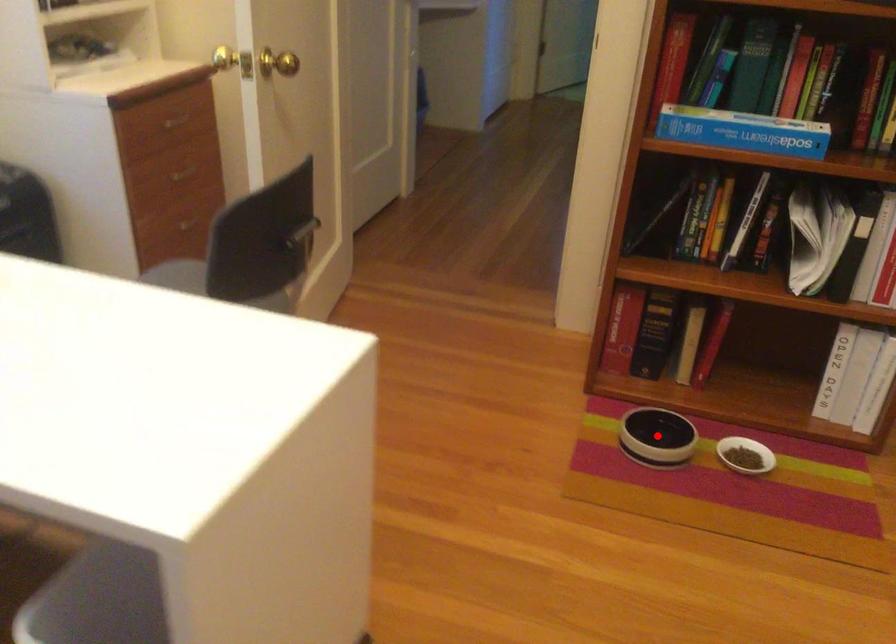
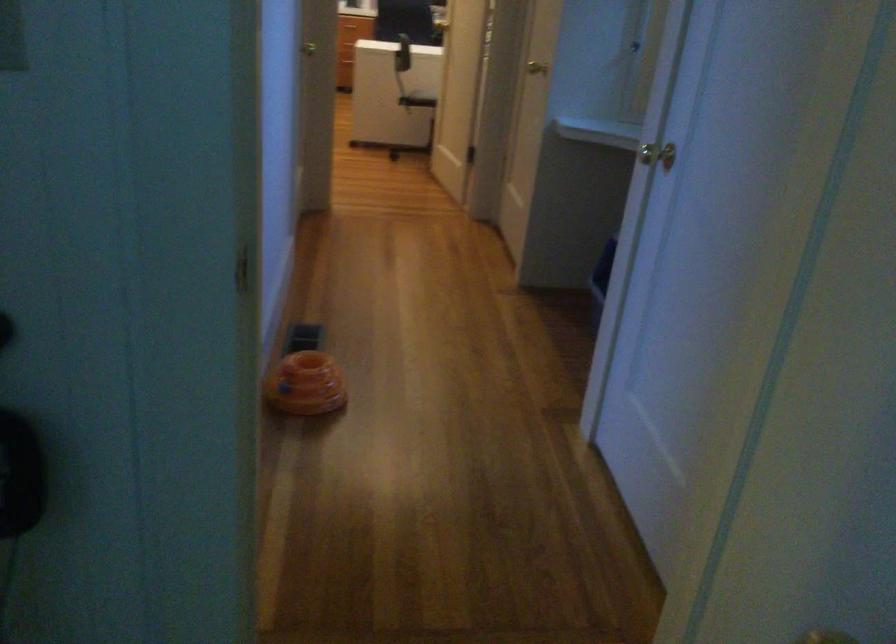
Question: I am providing you with two images of the same scene from different viewpoints. A red point is marked on the first image. Can you still see the location of the red point in image 2?

Choices:
 (A) Yes
 (B) No

Answer: (B)